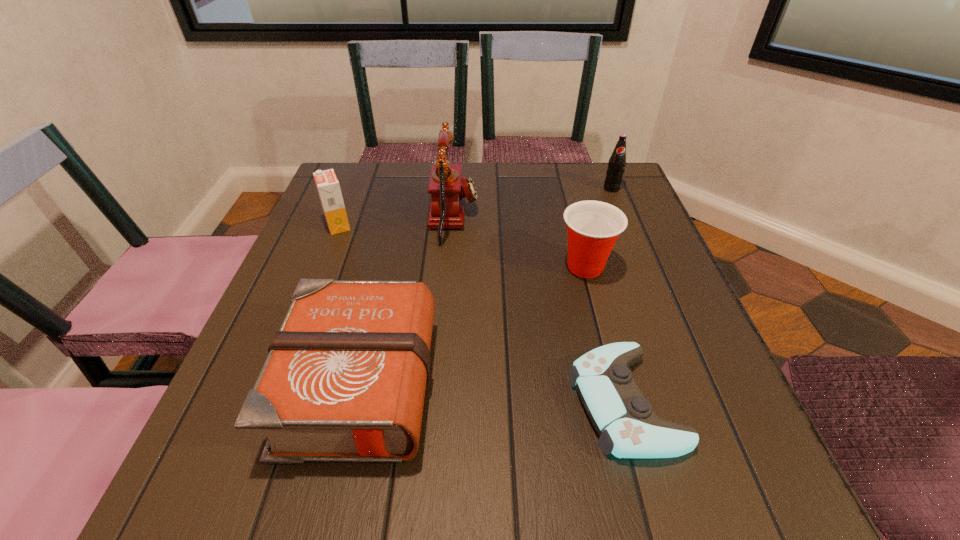
This screenshot has height=540, width=960. In the image, there is a desktop. In order to click on vacant space at the far right corner in this screenshot , I will do `click(608, 199)`.

Identify the location of free region at the near right corner of the desktop. (695, 484).

The height and width of the screenshot is (540, 960). Identify the location of vacant area that lies between the Bible and the shortest object. (488, 391).

Find the location of a particular element. The width and height of the screenshot is (960, 540). vacant point located between the orange juice and the control is located at coordinates (482, 314).

Find the location of a particular element. The image size is (960, 540). blank region between the Bible and the fourth farthest object is located at coordinates (468, 323).

This screenshot has height=540, width=960. What are the coordinates of `empty space between the shortest object and the orange juice` in the screenshot? It's located at (482, 314).

Identify the location of free space that is in between the cup and the telephone. Image resolution: width=960 pixels, height=540 pixels. (519, 242).

This screenshot has height=540, width=960. What are the coordinates of `vacant point located between the Bible and the shortest object` in the screenshot? It's located at pyautogui.click(x=488, y=391).

Identify the location of free spot between the shortest object and the orange juice. 482,314.

Where is `free point between the shortest object and the orange juice`? The width and height of the screenshot is (960, 540). free point between the shortest object and the orange juice is located at coordinates (482, 314).